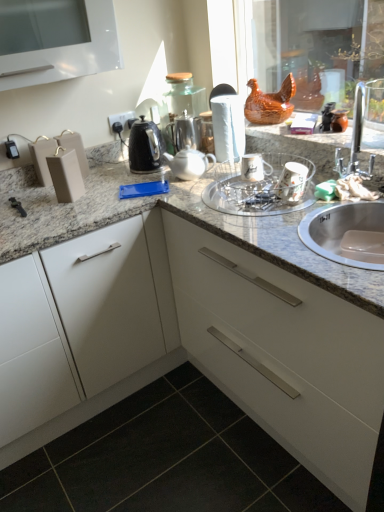
Question: Does point (0, 494) appear closer or farther from the camera than point (203, 170)?

Choices:
 (A) farther
 (B) closer

Answer: (B)

Question: Which is correct: black tile at lower left is inside white glossy tea pot at center, acting as the 2th tea pot starting from the back, or outside of it?

Choices:
 (A) outside
 (B) inside

Answer: (A)

Question: Estimate the real-world distances between objects in this image. Which object is farther from the white glossy tea pot at center, which is the first tea pot in front-to-back order?

Choices:
 (A) brown glossy chicken at upper center
 (B) clear glass bowl at center
 (C) satin silver teapot at center, positioned as the second tea pot in front-to-back order
 (D) black tile at lower left
 (E) white matte paper towel at center

Answer: (D)

Question: Which of these objects is positioned closest to the white glossy tea pot at center, which is the first tea pot in front-to-back order?

Choices:
 (A) satin silver teapot at center, positioned as the second tea pot in front-to-back order
 (B) silver metallic sink at right
 (C) white matte paper towel at center
 (D) brown glossy chicken at upper center
 (E) black tile at lower left

Answer: (A)